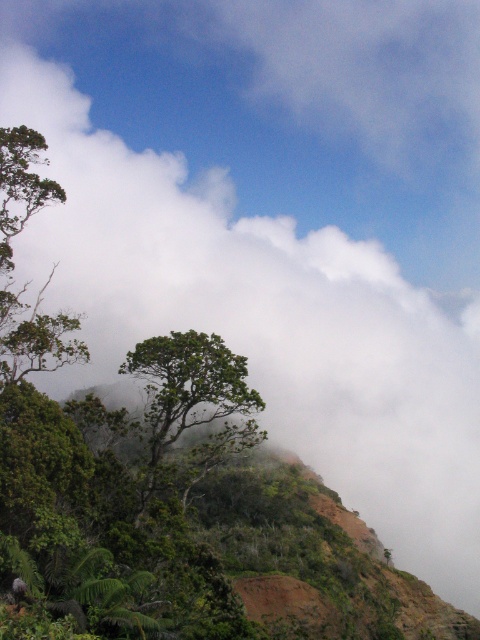
Question: Which of the following is the closest to the observer?

Choices:
 (A) (155, 461)
 (B) (38, 163)

Answer: (A)

Question: Does green leafy tree at left appear on the left side of green leafy tree at center?

Choices:
 (A) no
 (B) yes

Answer: (B)

Question: Can you confirm if green leafy tree at left is positioned to the right of green leafy tree at center?

Choices:
 (A) no
 (B) yes

Answer: (A)

Question: Can you confirm if green leafy tree at left is wider than green leafy tree at center?

Choices:
 (A) no
 (B) yes

Answer: (B)

Question: Which point is farther to the camera?

Choices:
 (A) green leafy tree at center
 (B) green leafy tree at left

Answer: (A)

Question: Which point is closer to the camera?

Choices:
 (A) coord(145,497)
 (B) coord(27,355)

Answer: (B)